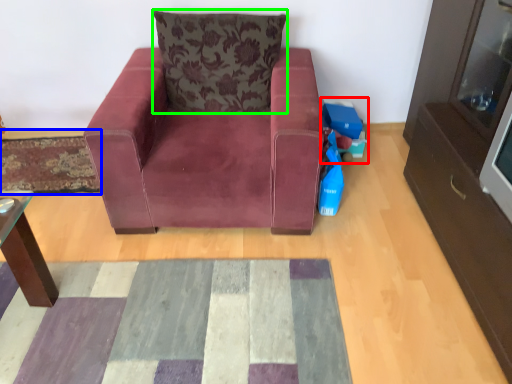
Question: Considering the real-world distances, which object is farthest from toy (highlighted by a red box)? mat (highlighted by a blue box) or pillow (highlighted by a green box)?

Choices:
 (A) mat
 (B) pillow

Answer: (A)